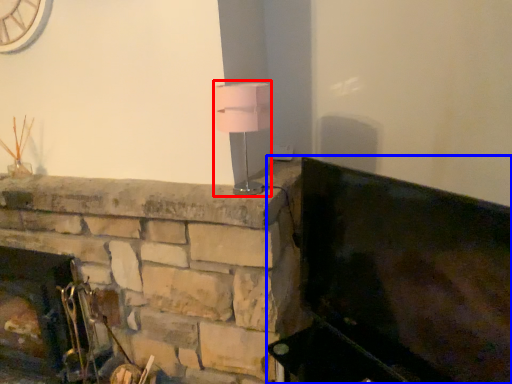
Question: Which object appears closest to the camera in this image, table lamp (highlighted by a red box) or furniture (highlighted by a blue box)?

Choices:
 (A) table lamp
 (B) furniture

Answer: (B)